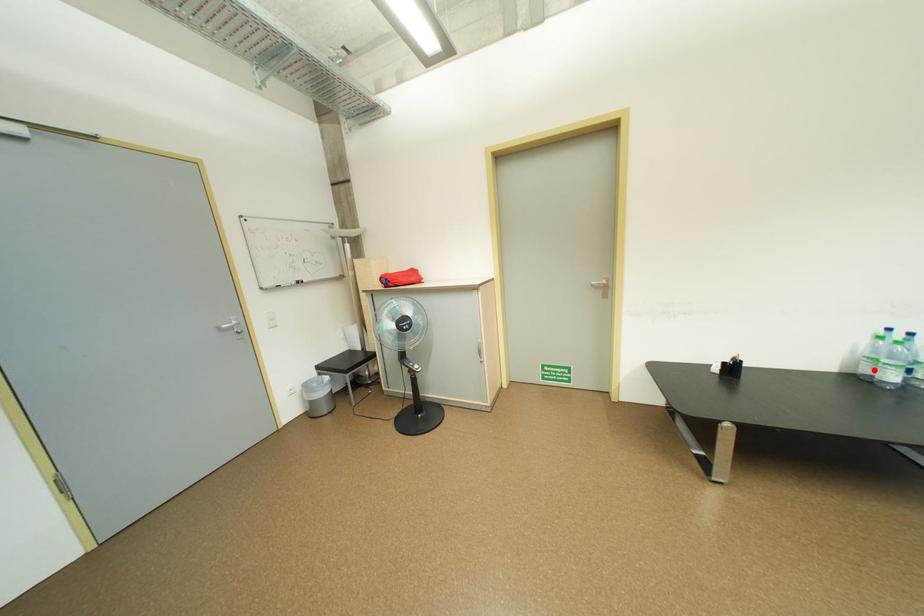
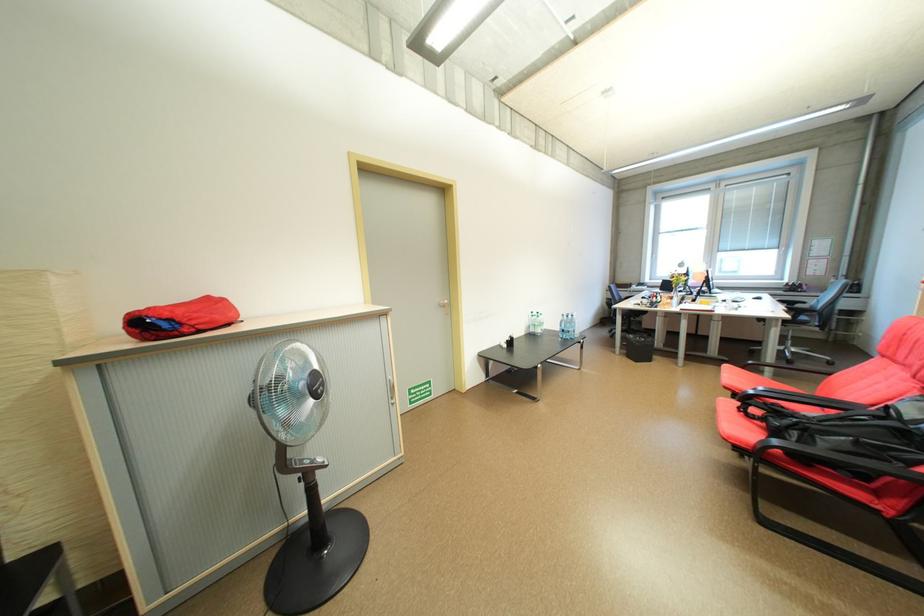
Question: I am providing you with two images of the same scene from different viewpoints. A red point is marked on the first image. Can you still see the location of the red point in image 2?

Choices:
 (A) Yes
 (B) No

Answer: (A)